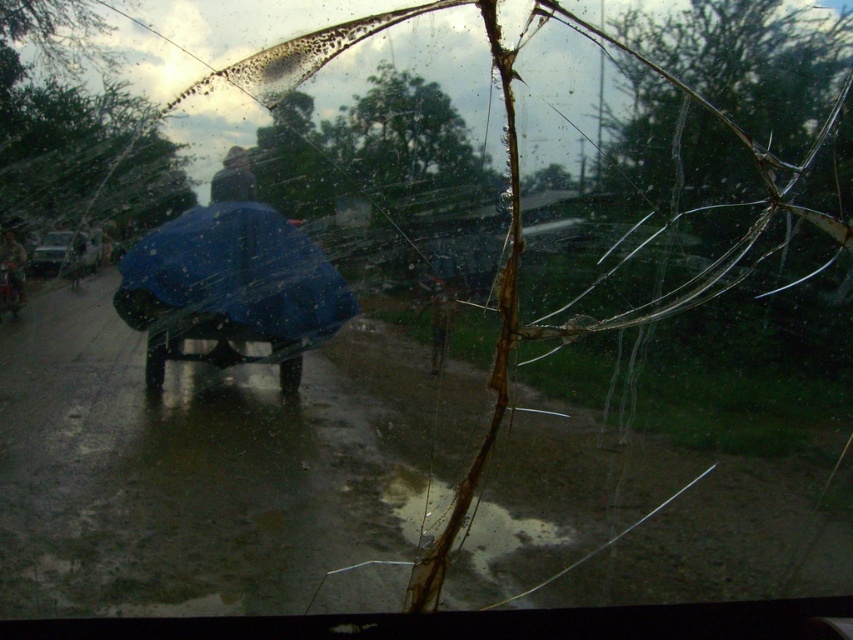
Is metallic silver car at left wider than blue fabric umbrella at left?

Yes, metallic silver car at left is wider than blue fabric umbrella at left.

Does metallic silver car at left lie behind blue fabric umbrella at left?

Yes, metallic silver car at left is further from the viewer.

Which is in front, point (33, 269) or point (22, 276)?

Point (22, 276) is in front.

Where is `metallic silver car at left`? This screenshot has width=853, height=640. metallic silver car at left is located at coordinates (64, 252).